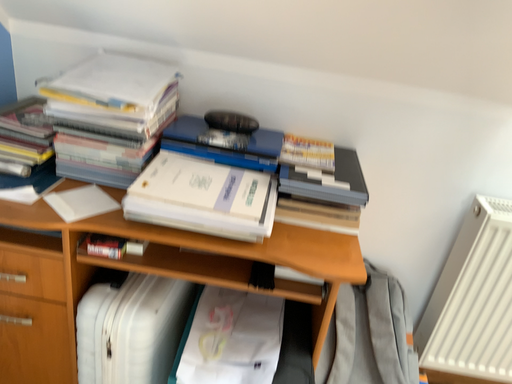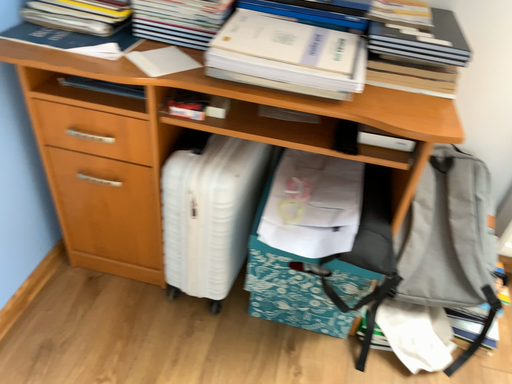
Question: How did the camera likely rotate when shooting the video?

Choices:
 (A) rotated upward
 (B) rotated downward

Answer: (B)